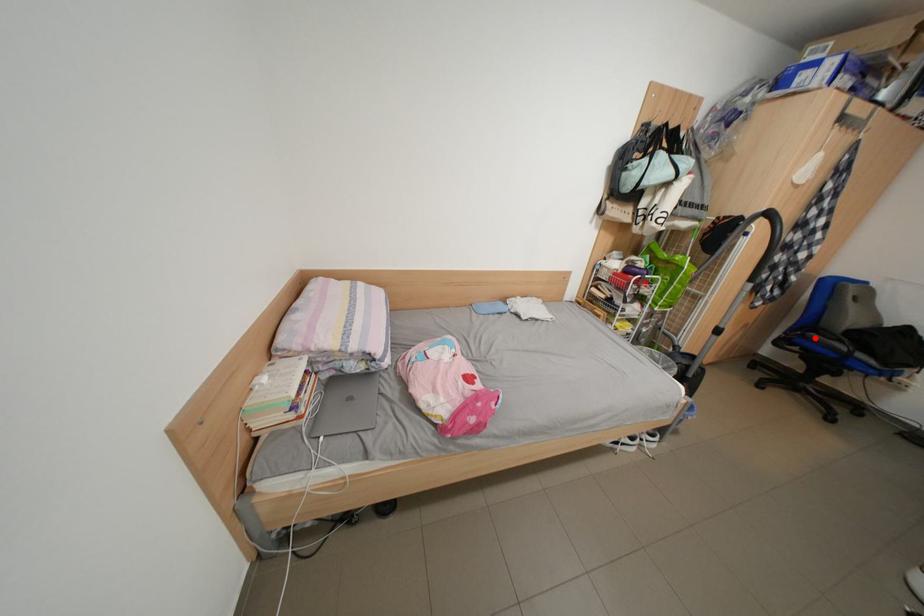
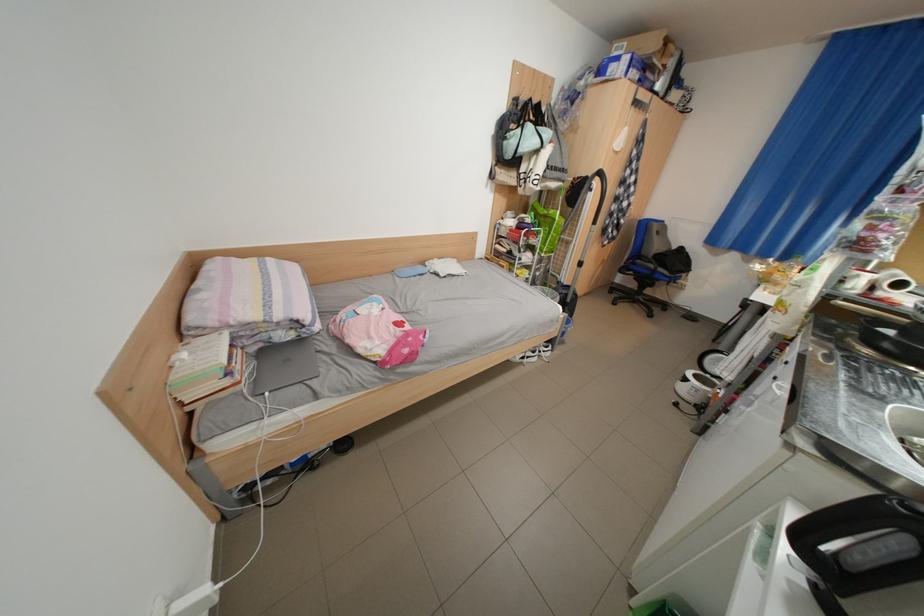
Where in the second image is the point corresponding to the highlighted location from the first image?

(646, 265)